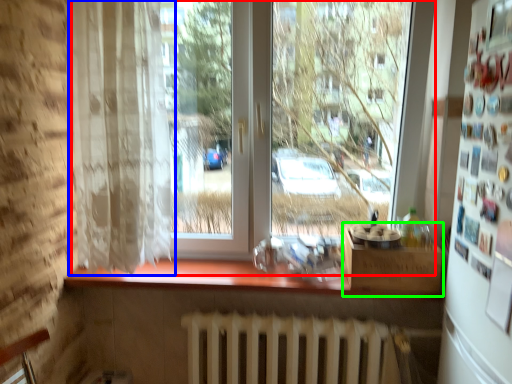
Question: Which is farther away from window (highlighted by a red box)? curtain (highlighted by a blue box) or window box (highlighted by a green box)?

Choices:
 (A) curtain
 (B) window box

Answer: (B)